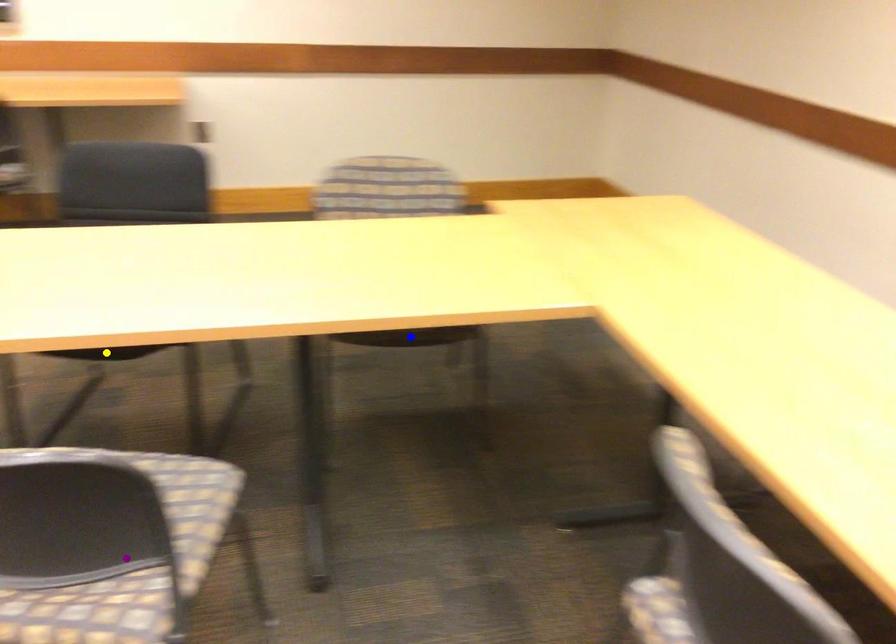
Based on the photo, order these from nearest to farthest:
yellow point | blue point | purple point

purple point, yellow point, blue point